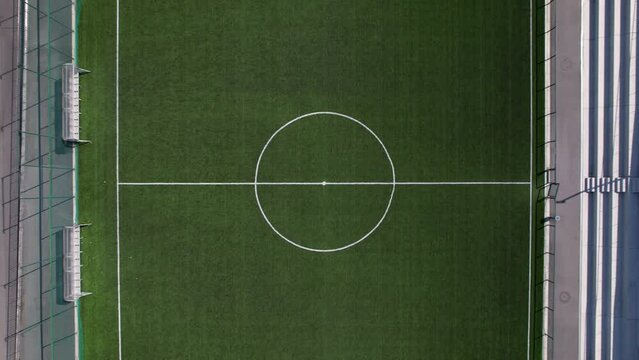
Locate an element on the screen. chair is located at coordinates (546, 178).